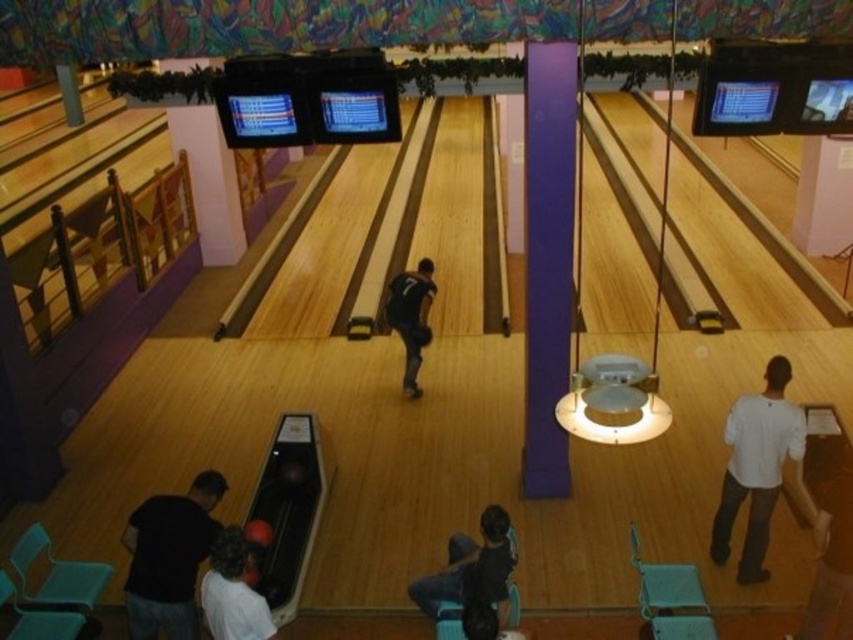
Question: Does white matte shirt at right appear under white shirt at lower left?

Choices:
 (A) no
 (B) yes

Answer: (A)

Question: Does black cotton shirt at lower left have a smaller size compared to white matte shirt at right?

Choices:
 (A) no
 (B) yes

Answer: (B)

Question: Which point appears farthest from the camera in this image?

Choices:
 (A) (419, 312)
 (B) (215, 608)
 (C) (764, 403)
 (D) (161, 512)

Answer: (A)

Question: Which point appears closest to the camera in this image?

Choices:
 (A) (422, 323)
 (B) (506, 518)
 (C) (718, 557)
 (D) (212, 612)

Answer: (D)

Question: Which point is farther from the camera taking this photo?

Choices:
 (A) (138, 605)
 (B) (242, 536)

Answer: (A)

Question: Can you confirm if white shirt at lower left is bigger than black matte shirt at center?

Choices:
 (A) yes
 (B) no

Answer: (B)